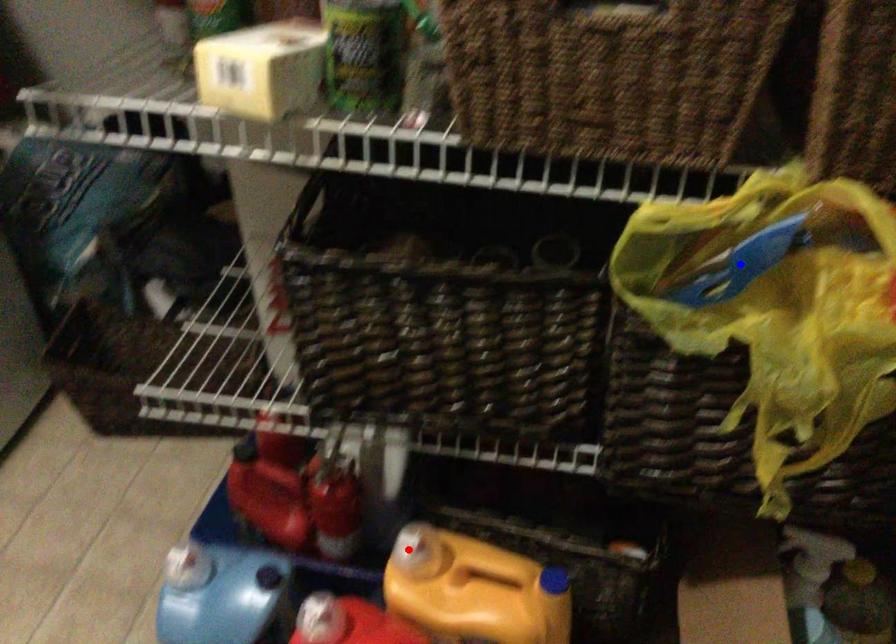
Question: In the image, two points are highlighted. Which point is nearer to the camera? Reply with the corresponding letter.

Choices:
 (A) blue point
 (B) red point

Answer: (A)